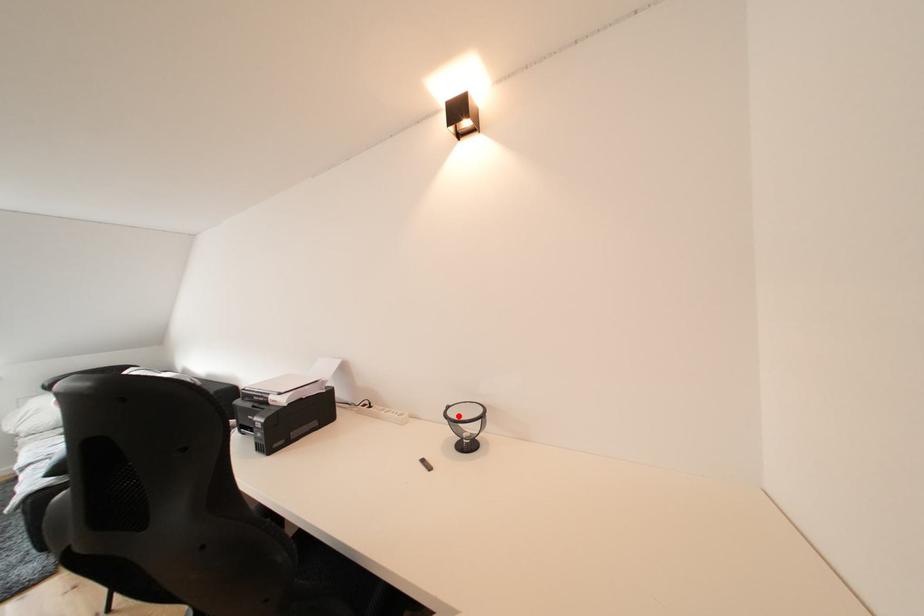
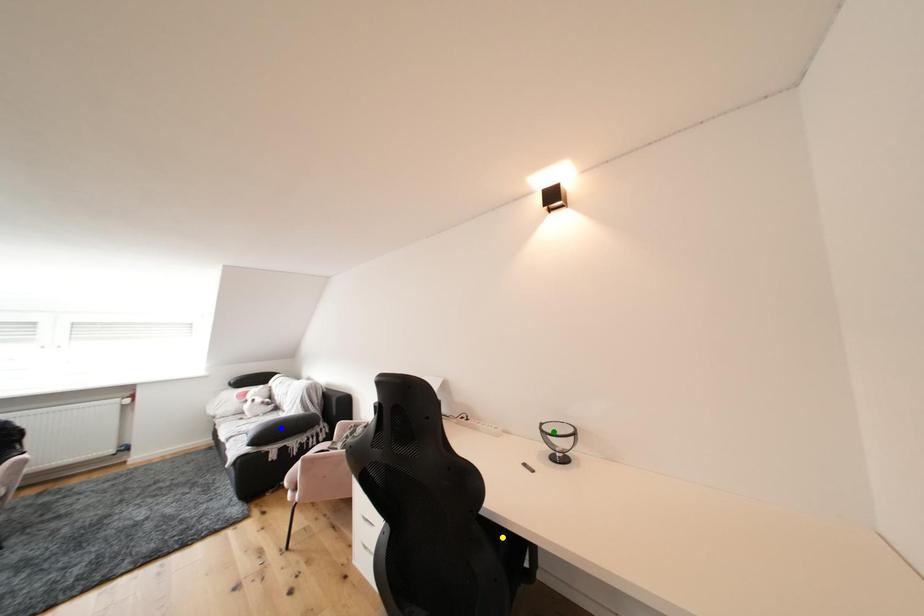
Question: I am providing you with two images of the same scene from different viewpoints. A red point is marked on the first image. You are given multiple points on the second image. Which mark in image 2 goes with the point in image 1?

Choices:
 (A) blue point
 (B) green point
 (C) yellow point

Answer: (B)